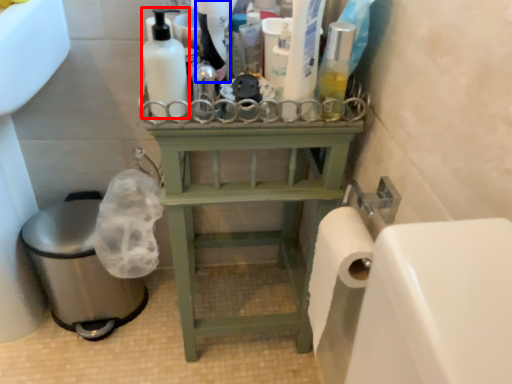
Question: Which of the following is the farthest to the observer, cleaning product (highlighted by a red box) or cleaning product (highlighted by a blue box)?

Choices:
 (A) cleaning product
 (B) cleaning product

Answer: (B)